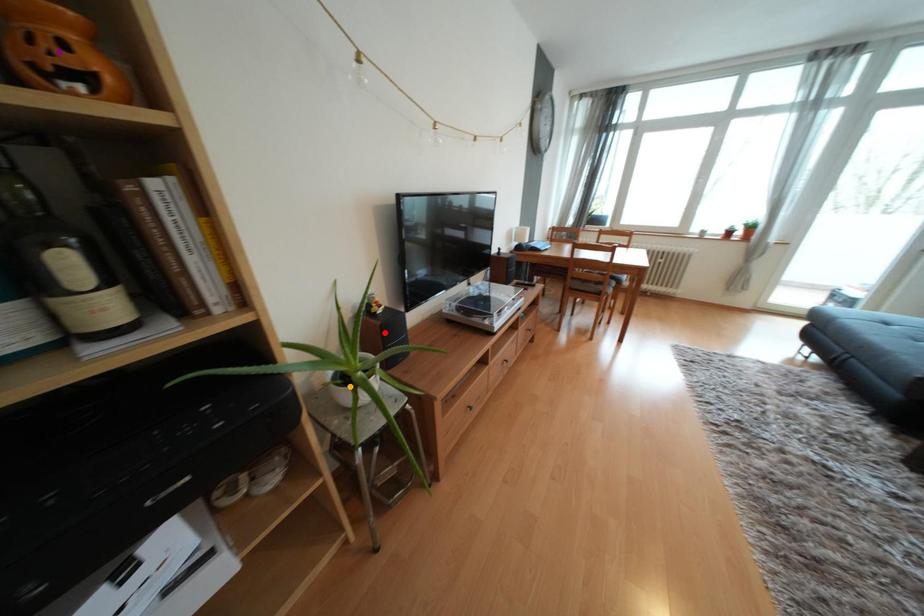
Order these from farthest to nearest:
orange point | red point | purple point

1. red point
2. orange point
3. purple point